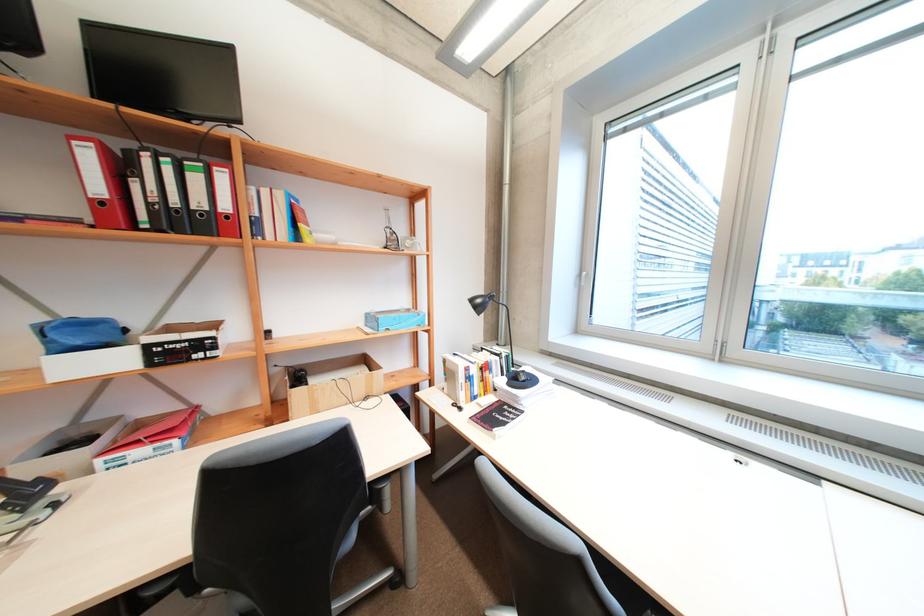
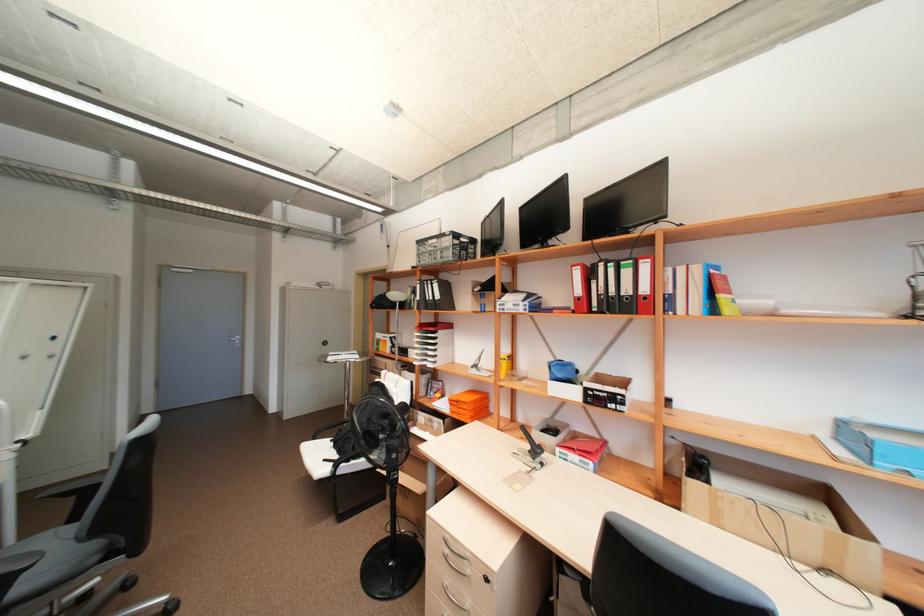
Where in the second image is the point corresponding to [169,232] from the first image?

(610, 313)